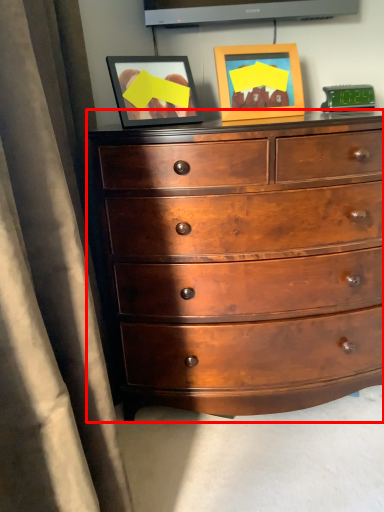
Question: From the image's perspective, what is the correct spatial relationship of chest of drawers (annotated by the red box) in relation to picture frame?

Choices:
 (A) above
 (B) below

Answer: (B)